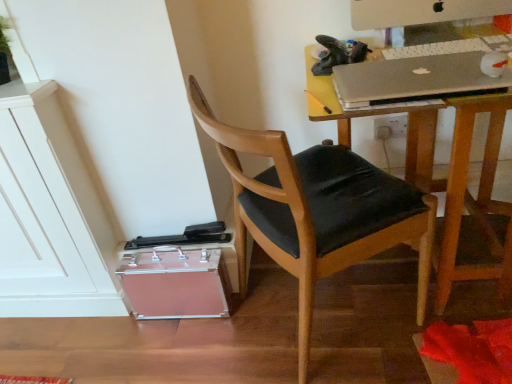
Where is `silver metallic laptop at upper right`? Image resolution: width=512 pixels, height=384 pixels. silver metallic laptop at upper right is located at coordinates (415, 79).

Image resolution: width=512 pixels, height=384 pixels. What do you see at coordinates (317, 211) in the screenshot?
I see `wooden chair with black cushion at center` at bounding box center [317, 211].

What do you see at coordinates (421, 12) in the screenshot?
I see `white plastic computer monitor at upper right` at bounding box center [421, 12].

At what (x,y) coordinates should I click in order to perform the action: click on metallic silver desk at upper right. Please return your answer as a coordinate pair (x, y). Looking at the image, I should click on tap(456, 189).

Locate an element on the screen. Image resolution: width=512 pixels, height=384 pixels. silver metallic laptop at upper right is located at coordinates (415, 79).

Does point (407, 79) appear closer or farther from the camera than point (359, 29)?

Point (407, 79) is closer to the camera than point (359, 29).

From a real-world perspective, is silver metallic laptop at upper right above or below white plastic computer monitor at upper right?

In terms of real-world spatial position, silver metallic laptop at upper right is below white plastic computer monitor at upper right.

Is silver metallic laptop at upper right to the right of white plastic computer monitor at upper right from the viewer's perspective?

Incorrect, silver metallic laptop at upper right is not on the right side of white plastic computer monitor at upper right.

Which is less distant, (486, 15) or (483, 39)?

The point (483, 39) is more forward.

From the image's perspective, relative to white plastic keyboard at upper right, is white plastic computer monitor at upper right above or below?

From the image's perspective, white plastic computer monitor at upper right appears above white plastic keyboard at upper right.

Is white plastic computer monitor at upper right positioned with its back to white plastic keyboard at upper right?

No, white plastic keyboard at upper right is not at the back of white plastic computer monitor at upper right.

Looking at the image, does wooden chair with black cushion at center seem bigger or smaller compared to white plastic computer monitor at upper right?

Considering their sizes, wooden chair with black cushion at center takes up more space than white plastic computer monitor at upper right.

From the image's perspective, is wooden chair with black cushion at center positioned above or below white plastic computer monitor at upper right?

Clearly, from the image's perspective, wooden chair with black cushion at center is below white plastic computer monitor at upper right.

Which is closer, (395,206) or (478,9)?

The point (395,206) is closer to the camera.

Locate an element on the screen. The width and height of the screenshot is (512, 384). computer monitor lying above the wooden chair with black cushion at center (from the image's perspective) is located at coordinates (421, 12).

Does white plastic keyboard at upper right lie behind white plastic computer monitor at upper right?

No, it is in front of white plastic computer monitor at upper right.

Based on the photo, from a real-world perspective, which is physically above, white plastic keyboard at upper right or white plastic computer monitor at upper right?

white plastic computer monitor at upper right is physically above.

Consider the image. How far apart are white plastic keyboard at upper right and white plastic computer monitor at upper right?

white plastic keyboard at upper right is 3.95 inches away from white plastic computer monitor at upper right.

Between white plastic keyboard at upper right and white plastic computer monitor at upper right, which one has larger width?

white plastic computer monitor at upper right is wider.

Find the location of a particular element. laptop above the metallic silver desk at upper right (from the image's perspective) is located at coordinates (415, 79).

Consider the image. How different are the orientations of silver metallic laptop at upper right and metallic silver desk at upper right in degrees?

The angle between the facing direction of silver metallic laptop at upper right and the facing direction of metallic silver desk at upper right is 0.00104 degrees.

Considering the sizes of objects silver metallic laptop at upper right and metallic silver desk at upper right in the image provided, who is shorter, silver metallic laptop at upper right or metallic silver desk at upper right?

silver metallic laptop at upper right.

Is the surface of silver metallic laptop at upper right in direct contact with metallic silver desk at upper right?

There is a gap between silver metallic laptop at upper right and metallic silver desk at upper right.

Is white plastic keyboard at upper right far from metallic silver desk at upper right?

white plastic keyboard at upper right is actually quite close to metallic silver desk at upper right.

Is white plastic keyboard at upper right thinner than metallic silver desk at upper right?

Yes, white plastic keyboard at upper right is thinner than metallic silver desk at upper right.

Is point (426, 44) farther from viewer compared to point (490, 158)?

No, it is not.

Which of these two, white plastic computer monitor at upper right or wooden chair with black cushion at center, is thinner?

With smaller width is white plastic computer monitor at upper right.

Does white plastic computer monitor at upper right turn towards wooden chair with black cushion at center?

No.

Is point (479, 4) farther from camera compared to point (302, 166)?

That is False.

Does white plastic computer monitor at upper right lie behind wooden chair with black cushion at center?

Yes.

The height and width of the screenshot is (384, 512). I want to click on computer monitor above the silver metallic laptop at upper right (from the image's perspective), so click(421, 12).

Find the location of `computer monitor lying behind the white plastic keyboard at upper right`. computer monitor lying behind the white plastic keyboard at upper right is located at coordinates (421, 12).

Consider the image. Based on their spatial positions, is wooden chair with black cushion at center or white plastic computer monitor at upper right further from silver metallic laptop at upper right?

The object further to silver metallic laptop at upper right is wooden chair with black cushion at center.

Considering their positions, is white plastic computer monitor at upper right positioned closer to silver metallic laptop at upper right than metallic silver desk at upper right?

The object closer to silver metallic laptop at upper right is metallic silver desk at upper right.

When comparing their distances from white plastic computer monitor at upper right, does silver metallic laptop at upper right or white plastic keyboard at upper right seem further?

silver metallic laptop at upper right.

Looking at the image, which one is located closer to silver metallic laptop at upper right, metallic silver desk at upper right or wooden chair with black cushion at center?

Based on the image, metallic silver desk at upper right appears to be nearer to silver metallic laptop at upper right.

Based on their spatial positions, is metallic silver desk at upper right or white plastic keyboard at upper right further from wooden chair with black cushion at center?

Based on the image, white plastic keyboard at upper right appears to be further to wooden chair with black cushion at center.

When comparing their distances from wooden chair with black cushion at center, does silver metallic laptop at upper right or metallic silver desk at upper right seem further?

silver metallic laptop at upper right is further to wooden chair with black cushion at center.

From the image, which object appears to be nearer to silver metallic laptop at upper right, white plastic keyboard at upper right or wooden chair with black cushion at center?

The object closer to silver metallic laptop at upper right is white plastic keyboard at upper right.

When comparing their distances from white plastic computer monitor at upper right, does white plastic keyboard at upper right or metallic silver desk at upper right seem closer?

white plastic keyboard at upper right is closer to white plastic computer monitor at upper right.

Find the location of a particular element. The width and height of the screenshot is (512, 384). laptop keyboard between white plastic computer monitor at upper right and metallic silver desk at upper right in the vertical direction is located at coordinates (451, 47).

Locate an element on the screen. The image size is (512, 384). laptop between wooden chair with black cushion at center and metallic silver desk at upper right from left to right is located at coordinates (415, 79).

Locate an element on the screen. The image size is (512, 384). laptop keyboard between silver metallic laptop at upper right and white plastic computer monitor at upper right along the z-axis is located at coordinates (451, 47).

Find the location of a particular element. The width and height of the screenshot is (512, 384). laptop between white plastic keyboard at upper right and metallic silver desk at upper right vertically is located at coordinates (415, 79).